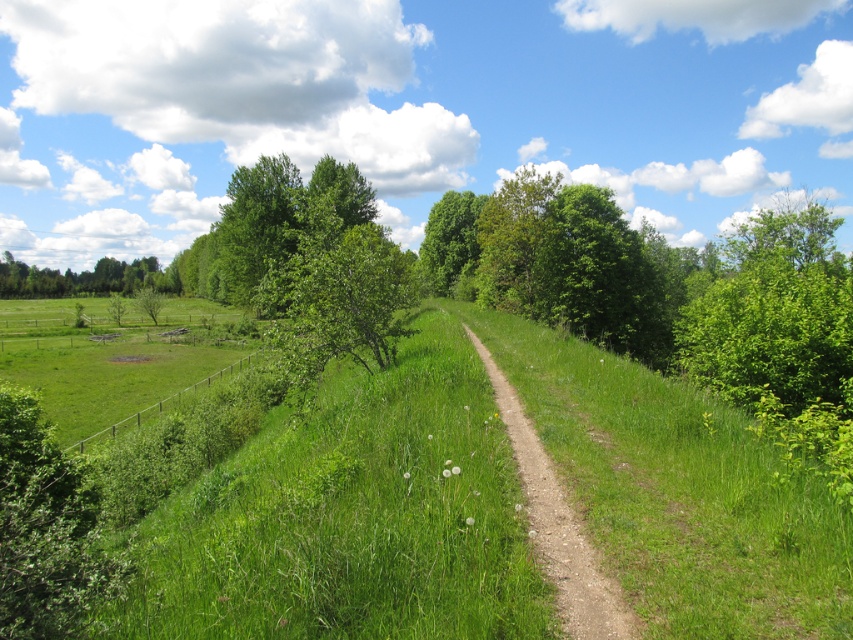
You are a hiker walking along the dirt path at center and want to take shelter from the sun. Is there a green leafy tree at center that you can stand under for shade?

Yes, the dirt path at center is positioned under the green leafy tree at center, so you can stand on the dirt path at center to be under the tree for shade.

In the scene shown: You are a gardener planning to plant a new row of flowers between the green leafy shrub at lower left and the green leafy tree at left. Considering their sizes, which one should you place the flowers closer to to ensure they have enough space?

The green leafy shrub at lower left has a lesser width compared to the green leafy tree at left, so you should plant the flowers closer to the green leafy shrub at lower left to ensure they have enough space.

You are standing at the start of the dirt path at center and want to reach the green leafy tree at center. Which direction should you walk to get closer to the tree?

You should walk forward along the dirt path at center because the green leafy tree at center is further away from you than the path, so moving forward along the path will bring you closer to the tree.